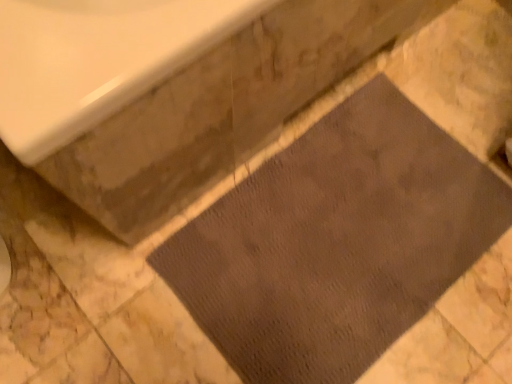
The width and height of the screenshot is (512, 384). Describe the element at coordinates (336, 242) in the screenshot. I see `brown textured mat at center` at that location.

What are the coordinates of `brown textured mat at center` in the screenshot? It's located at (336, 242).

Locate an element on the screen. brown textured mat at lower right is located at coordinates (218, 111).

Describe the element at coordinates (218, 111) in the screenshot. This screenshot has width=512, height=384. I see `brown textured mat at lower right` at that location.

This screenshot has height=384, width=512. Identify the location of brown textured mat at center. (336, 242).

Which is more to the left, brown textured mat at center or brown textured mat at lower right?

From the viewer's perspective, brown textured mat at lower right appears more on the left side.

Is brown textured mat at center in front of brown textured mat at lower right?

No, brown textured mat at center is further to the viewer.

Which is more distant, [339,350] or [215,83]?

The point [339,350] is behind.

From the image's perspective, between brown textured mat at center and brown textured mat at lower right, who is located below?

brown textured mat at center.

From a real-world perspective, is brown textured mat at center on brown textured mat at lower right?

No, from a real-world perspective, brown textured mat at center is not above brown textured mat at lower right.

Does brown textured mat at center have a greater width compared to brown textured mat at lower right?

Incorrect, the width of brown textured mat at center does not surpass that of brown textured mat at lower right.

Which of these two, brown textured mat at center or brown textured mat at lower right, stands shorter?

Standing shorter between the two is brown textured mat at center.

Which of these two, brown textured mat at center or brown textured mat at lower right, is bigger?

brown textured mat at lower right.

Would you say brown textured mat at center is inside or outside brown textured mat at lower right?

brown textured mat at center is located beyond the bounds of brown textured mat at lower right.

Would you consider brown textured mat at center to be distant from brown textured mat at lower right?

No, brown textured mat at center is in close proximity to brown textured mat at lower right.

Is brown textured mat at center aimed at brown textured mat at lower right?

No, brown textured mat at center is not facing towards brown textured mat at lower right.

How many degrees apart are the facing directions of brown textured mat at center and brown textured mat at lower right?

The facing directions of brown textured mat at center and brown textured mat at lower right are 0.835 degrees apart.

In order to click on bath above the brown textured mat at center (from a real-world perspective) in this screenshot , I will do `click(218, 111)`.

Between brown textured mat at lower right and brown textured mat at center, which one appears on the right side from the viewer's perspective?

From the viewer's perspective, brown textured mat at center appears more on the right side.

Considering the positions of objects brown textured mat at lower right and brown textured mat at center in the image provided, who is in front, brown textured mat at lower right or brown textured mat at center?

brown textured mat at lower right is in front.

Does point (368, 7) come in front of point (321, 196)?

That is True.

From the image's perspective, is brown textured mat at lower right over brown textured mat at center?

Correct, brown textured mat at lower right appears higher than brown textured mat at center in the image.

From a real-world perspective, is brown textured mat at lower right under brown textured mat at center?

Incorrect, from a real-world perspective, brown textured mat at lower right is higher than brown textured mat at center.

Is brown textured mat at lower right thinner than brown textured mat at center?

In fact, brown textured mat at lower right might be wider than brown textured mat at center.

Is brown textured mat at lower right shorter than brown textured mat at center?

No, brown textured mat at lower right is not shorter than brown textured mat at center.

Considering the sizes of brown textured mat at lower right and brown textured mat at center in the image, is brown textured mat at lower right bigger or smaller than brown textured mat at center?

In the image, brown textured mat at lower right appears to be larger than brown textured mat at center.

Is brown textured mat at lower right located outside brown textured mat at center?

Yes.

Would you say brown textured mat at lower right is a long distance from brown textured mat at center?

No, brown textured mat at lower right is in close proximity to brown textured mat at center.

Looking at this image, could you tell me if brown textured mat at lower right is turned towards brown textured mat at center?

Yes.

Measure the distance from brown textured mat at lower right to brown textured mat at center.

brown textured mat at lower right and brown textured mat at center are 11.34 inches apart from each other.

I want to click on bath on the left of brown textured mat at center, so click(218, 111).

Where is `bath positioned vertically above the brown textured mat at center (from a real-world perspective)`? The image size is (512, 384). bath positioned vertically above the brown textured mat at center (from a real-world perspective) is located at coordinates (218, 111).

Where is `doormat on the right side of brown textured mat at lower right`? This screenshot has height=384, width=512. doormat on the right side of brown textured mat at lower right is located at coordinates (336, 242).